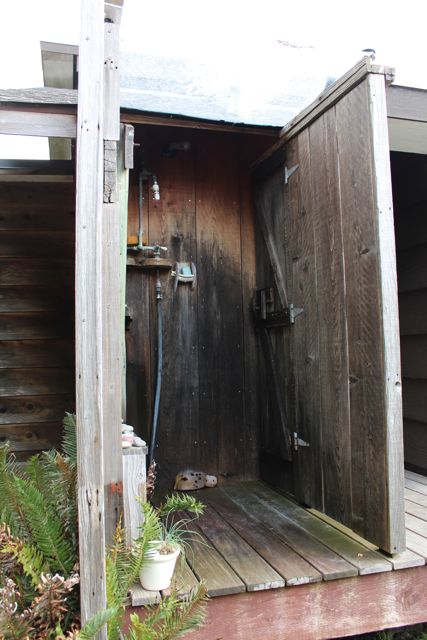
Image resolution: width=427 pixels, height=640 pixels. In order to click on door in this screenshot , I will do `click(307, 173)`.